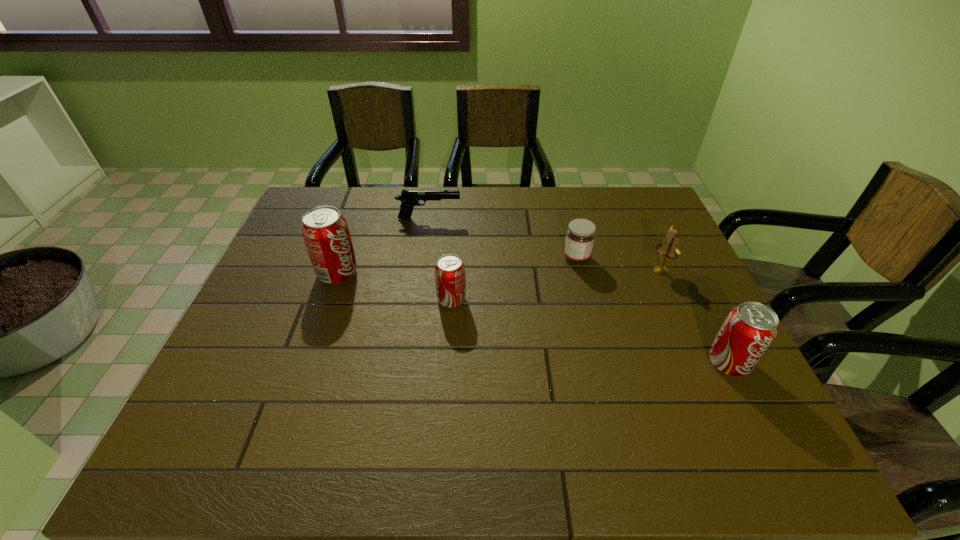
Identify the location of vacant space situated on the left of the shortest soda. (418, 300).

The width and height of the screenshot is (960, 540). Identify the location of vacant space located 0.250m on the back of the rightmost soda. (684, 275).

Where is `blank area located on the left of the candle holder`? blank area located on the left of the candle holder is located at coordinates (592, 271).

Identify the location of vacant area situated at the aiming end of the gun. The height and width of the screenshot is (540, 960). (560, 219).

Where is `blank area located on the front of the third object from right to left`? blank area located on the front of the third object from right to left is located at coordinates (600, 352).

Identify the location of object that is at the far edge. The image size is (960, 540). (409, 198).

This screenshot has height=540, width=960. Find the location of `object situated at the near edge`. object situated at the near edge is located at coordinates (748, 331).

This screenshot has width=960, height=540. In order to click on object present at the left edge in this screenshot , I will do `click(325, 231)`.

This screenshot has height=540, width=960. In order to click on soda situated at the right edge in this screenshot , I will do `click(748, 331)`.

The image size is (960, 540). I want to click on candle holder that is at the right edge, so click(668, 250).